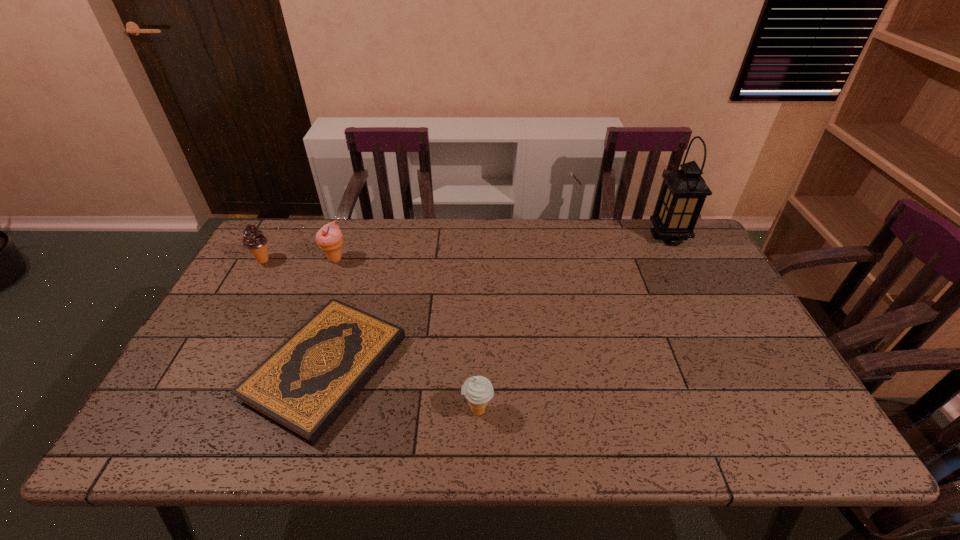
What are the coordinates of `free space at the near edge of the desktop` in the screenshot? It's located at (x=512, y=417).

I want to click on free region at the left edge of the desktop, so click(177, 382).

Identify the location of free space at the right edge of the desktop. This screenshot has height=540, width=960. (761, 341).

The width and height of the screenshot is (960, 540). Identify the location of free space at the far left corner of the desktop. (295, 227).

The height and width of the screenshot is (540, 960). In order to click on blank space at the near left corner in this screenshot , I will do `click(178, 447)`.

You are a GUI agent. You are given a task and a screenshot of the screen. Output one action in this format:
    pyautogui.click(x=<x>, y=<y>)
    Task: Click on the free point between the second icecream from left to right and the leftmost object
    
    Given the screenshot: What is the action you would take?
    pyautogui.click(x=300, y=260)

Locate an element on the screen. The image size is (960, 540). unoccupied position between the hardback book and the lantern is located at coordinates (497, 302).

You are a GUI agent. You are given a task and a screenshot of the screen. Output one action in this format:
    pyautogui.click(x=<x>, y=<y>)
    Task: Click on the free spot between the farthest object and the hardback book
    The width and height of the screenshot is (960, 540).
    Given the screenshot: What is the action you would take?
    pyautogui.click(x=497, y=302)

Find the location of a particular element. vacant area that lies between the second object from right to left and the shortest object is located at coordinates (402, 389).

The width and height of the screenshot is (960, 540). I want to click on vacant space that's between the leftmost object and the hardback book, so click(x=295, y=314).